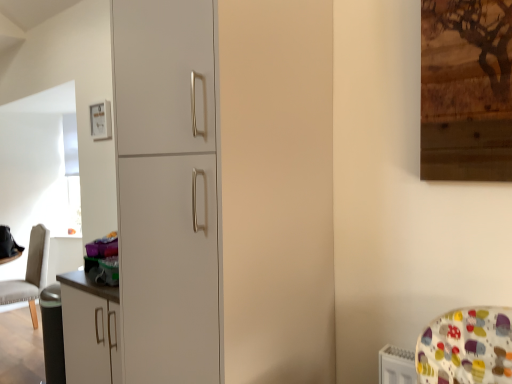
This screenshot has height=384, width=512. Describe the element at coordinates (100, 120) in the screenshot. I see `matte white picture frame at upper left` at that location.

Describe the element at coordinates (30, 273) in the screenshot. I see `leather-like beige chair at left` at that location.

Identify the location of matte white picture frame at upper left. This screenshot has height=384, width=512. (100, 120).

In the scene shown: From the image's perspective, is leather-like beige chair at left located beneath matte white picture frame at upper left?

Indeed, from the image's perspective, leather-like beige chair at left is shown beneath matte white picture frame at upper left.

From a real-world perspective, does leather-like beige chair at left sit lower than matte white picture frame at upper left?

Indeed, from a real-world perspective, leather-like beige chair at left is positioned beneath matte white picture frame at upper left.

Can you tell me how much leather-like beige chair at left and white matte cabinet at center differ in facing direction?

leather-like beige chair at left and white matte cabinet at center are facing 0.14 degrees away from each other.

Which is further, (33, 267) or (314, 223)?

The point (33, 267) is behind.

In the image, is leather-like beige chair at left positioned in front of or behind white matte cabinet at center?

leather-like beige chair at left is behind white matte cabinet at center.

The image size is (512, 384). I want to click on chair below the white matte cabinet at center (from the image's perspective), so click(30, 273).

Consider the image. From a real-world perspective, relative to leather-like beige chair at left, is white matte cabinet at center vertically above or below?

In terms of real-world spatial position, white matte cabinet at center is above leather-like beige chair at left.

Is white matte cabinet at center further to camera compared to leather-like beige chair at left?

No, it is in front of leather-like beige chair at left.

Are white matte cabinet at center and leather-like beige chair at left beside each other?

No, white matte cabinet at center is not beside leather-like beige chair at left.

From the image's perspective, does white matte cabinet at center appear higher than leather-like beige chair at left?

Yes.

From a real-world perspective, which is physically above, matte white picture frame at upper left or white matte cabinet at center?

In real-world perspective, matte white picture frame at upper left is above.

In terms of height, does matte white picture frame at upper left look taller or shorter compared to white matte cabinet at center?

Considering their sizes, matte white picture frame at upper left has less height than white matte cabinet at center.

Is matte white picture frame at upper left aimed at white matte cabinet at center?

No, matte white picture frame at upper left is not oriented towards white matte cabinet at center.

From the image's perspective, which object appears higher, matte white picture frame at upper left or white matte cabinet at center?

matte white picture frame at upper left appears higher in the image.

Which of these two, white matte cabinet at center or matte white picture frame at upper left, is thinner?

matte white picture frame at upper left.

Can you tell me how much white matte cabinet at center and matte white picture frame at upper left differ in facing direction?

The facing directions of white matte cabinet at center and matte white picture frame at upper left are 0.545 degrees apart.

Which of these two, white matte cabinet at center or matte white picture frame at upper left, stands shorter?

Standing shorter between the two is matte white picture frame at upper left.

Is the depth of white matte cabinet at center greater than that of matte white picture frame at upper left?

No.

Which object is closer to the camera, matte white picture frame at upper left or leather-like beige chair at left?

matte white picture frame at upper left is more forward.

Between matte white picture frame at upper left and leather-like beige chair at left, which one has more height?

leather-like beige chair at left is taller.

Between point (106, 120) and point (17, 287), which one is positioned behind?

Positioned behind is point (17, 287).

What's the angular difference between matte white picture frame at upper left and leather-like beige chair at left's facing directions?

The angle between the facing direction of matte white picture frame at upper left and the facing direction of leather-like beige chair at left is 0.685 degrees.

There is a leather-like beige chair at left. Where is `picture frame above it (from a real-world perspective)`? The width and height of the screenshot is (512, 384). picture frame above it (from a real-world perspective) is located at coordinates (100, 120).

You are a GUI agent. You are given a task and a screenshot of the screen. Output one action in this format:
    pyautogui.click(x=<x>, y=<y>)
    Task: Click on the chair located below the white matte cabinet at center (from the image's perspective)
    The height and width of the screenshot is (384, 512).
    Given the screenshot: What is the action you would take?
    pyautogui.click(x=30, y=273)

Based on their spatial positions, is leather-like beige chair at left or matte white picture frame at upper left closer to white matte cabinet at center?

Based on the image, matte white picture frame at upper left appears to be nearer to white matte cabinet at center.

Estimate the real-world distances between objects in this image. Which object is closer to white matte cabinet at center, matte white picture frame at upper left or leather-like beige chair at left?

matte white picture frame at upper left.

Based on the photo, looking at the image, which one is located closer to leather-like beige chair at left, white matte cabinet at center or matte white picture frame at upper left?

matte white picture frame at upper left is closer to leather-like beige chair at left.

Which object lies nearer to the anchor point leather-like beige chair at left, matte white picture frame at upper left or white matte cabinet at center?

matte white picture frame at upper left is positioned closer to the anchor leather-like beige chair at left.

Looking at the image, which one is located further to matte white picture frame at upper left, leather-like beige chair at left or white matte cabinet at center?

The object further to matte white picture frame at upper left is white matte cabinet at center.

Based on their spatial positions, is white matte cabinet at center or leather-like beige chair at left further from matte white picture frame at upper left?

white matte cabinet at center is further to matte white picture frame at upper left.

At what (x,y) coordinates should I click in order to perform the action: click on picture frame between white matte cabinet at center and leather-like beige chair at left from front to back. Please return your answer as a coordinate pair (x, y). This screenshot has width=512, height=384. Looking at the image, I should click on (100, 120).